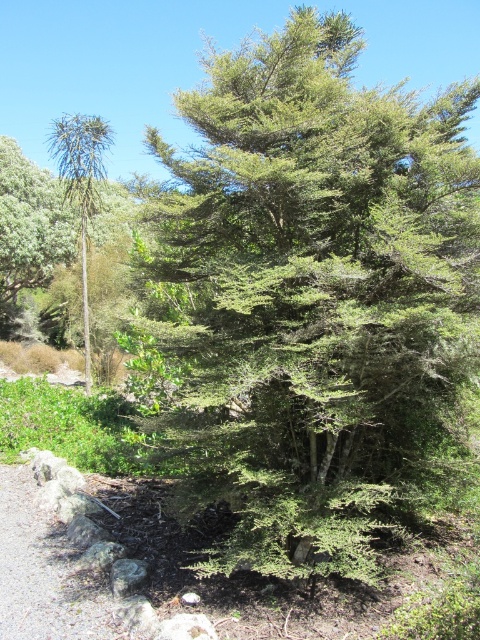
You are standing on the gray gravel trail at lower left and want to walk towards the green leafy tree at center. Which direction should you move?

You should move to your right because the green leafy tree at center is located to the right of the gray gravel trail at lower left.

You are standing at the origin point in the scene. Which object is closer to you, the green leafy tree at center or the palm plant to its left?

The green leafy tree at center is closer to you because its coordinates are at point [313,305], which is closer to the origin compared to the palm plant to its left.

Looking at this image, you are a hiker standing at the gray gravel trail at lower left. Looking towards the green leafy tree at center, where is the tree positioned relative to your location?

The green leafy tree at center is above the gray gravel trail at lower left, so from your position on the trail, the tree is located directly ahead and elevated in position.